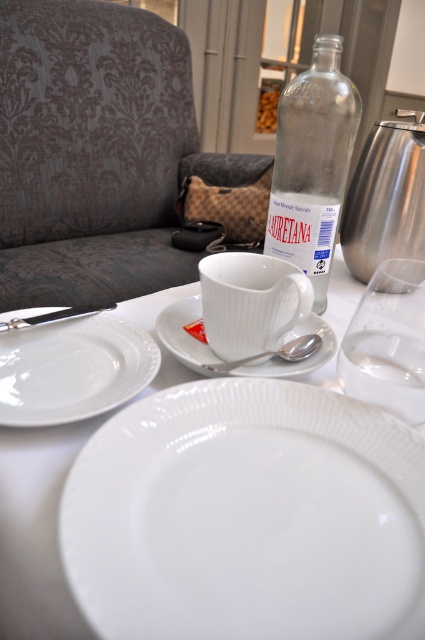
You are sitting at the table and want to reach for an object. There are two points marked on the table. Which point is closer to you, point (53, 272) or point (85, 308)?

Point (85, 308) is closer to you because point (53, 272) is behind it.

You are setting up a tea service and need to place the silver metallic spoon at center on the white ceramic saucer at center. Can the spoon fit on the saucer without hanging over the edge?

The white ceramic saucer at center has a larger size compared to silver metallic spoon at center, so the spoon will fit on the saucer without hanging over the edge.